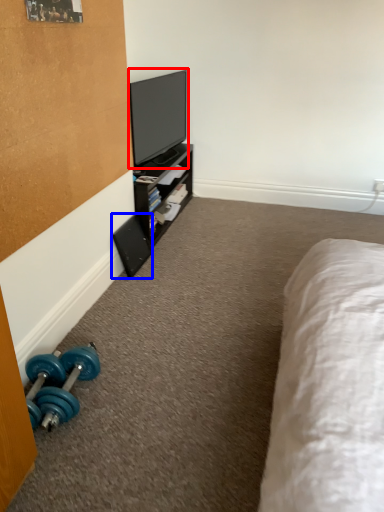
Question: Which point is further to the camera, television (highlighted by a red box) or speaker (highlighted by a blue box)?

Choices:
 (A) television
 (B) speaker

Answer: (A)